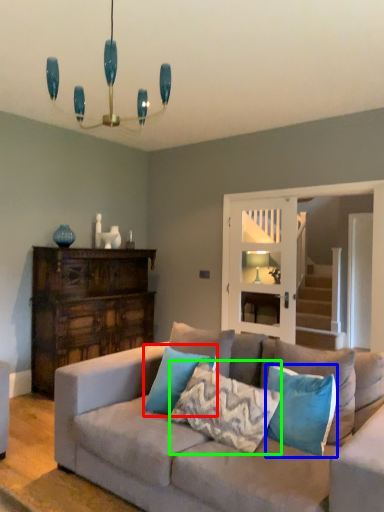
Question: Which object is the closest to the pillow (highlighted by a red box)? Choose among these: pillow (highlighted by a blue box) or pillow (highlighted by a green box).

Choices:
 (A) pillow
 (B) pillow

Answer: (B)